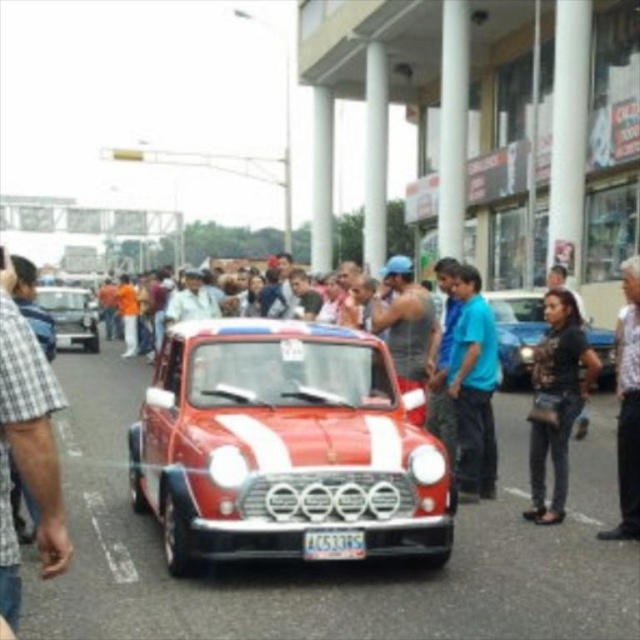
Question: Does shiny red car at center appear over white plastic license plate at center?

Choices:
 (A) yes
 (B) no

Answer: (A)

Question: Is shiny red car at center thinner than camouflage fabric jacket at center?

Choices:
 (A) yes
 (B) no

Answer: (B)

Question: Does blue cotton shirt at center have a greater width compared to camouflage fabric jacket at center?

Choices:
 (A) no
 (B) yes

Answer: (B)

Question: Which object is the farthest from the white textured shirt at right?

Choices:
 (A) blue cotton shirt at center
 (B) white plastic license plate at center

Answer: (B)

Question: Which point appears farthest from the camera in this image?

Choices:
 (A) (90, 310)
 (B) (529, 358)

Answer: (A)

Question: Among these objects, which one is nearest to the camera?

Choices:
 (A) blue hard hat at center
 (B) camouflage fabric jacket at center
 (C) denim jeans at lower right
 (D) shiny red car at center

Answer: (D)